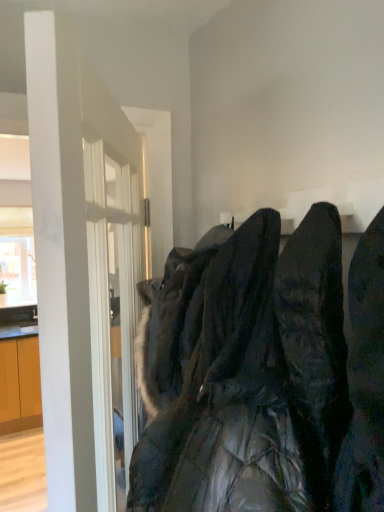
Question: Can you confirm if white glossy door at left is wider than black quilted jacket at center?

Choices:
 (A) yes
 (B) no

Answer: (B)

Question: Is white glossy door at left outside of black quilted jacket at center?

Choices:
 (A) yes
 (B) no

Answer: (A)

Question: Is white glossy door at left bigger than black quilted jacket at center?

Choices:
 (A) yes
 (B) no

Answer: (A)

Question: Is black quilted jacket at center completely or partially inside white glossy door at left?

Choices:
 (A) yes
 (B) no

Answer: (B)

Question: Is the surface of white glossy door at left in direct contact with black quilted jacket at center?

Choices:
 (A) no
 (B) yes

Answer: (A)

Question: Can you confirm if white glossy door at left is positioned to the left of black quilted jacket at center?

Choices:
 (A) no
 (B) yes

Answer: (B)

Question: Does black quilted jacket at center have a lesser height compared to white glossy door at left?

Choices:
 (A) yes
 (B) no

Answer: (A)

Question: Is black quilted jacket at center at the left side of white glossy door at left?

Choices:
 (A) no
 (B) yes

Answer: (A)

Question: Can you confirm if black quilted jacket at center is taller than white glossy door at left?

Choices:
 (A) no
 (B) yes

Answer: (A)

Question: Is black quilted jacket at center touching white glossy door at left?

Choices:
 (A) yes
 (B) no

Answer: (B)

Question: From the image's perspective, is black quilted jacket at center below white glossy door at left?

Choices:
 (A) no
 (B) yes

Answer: (A)

Question: Is black quilted jacket at center outside of white glossy door at left?

Choices:
 (A) yes
 (B) no

Answer: (A)

Question: Considering their positions, is white glossy door at left located in front of or behind black quilted jacket at center?

Choices:
 (A) behind
 (B) front

Answer: (A)